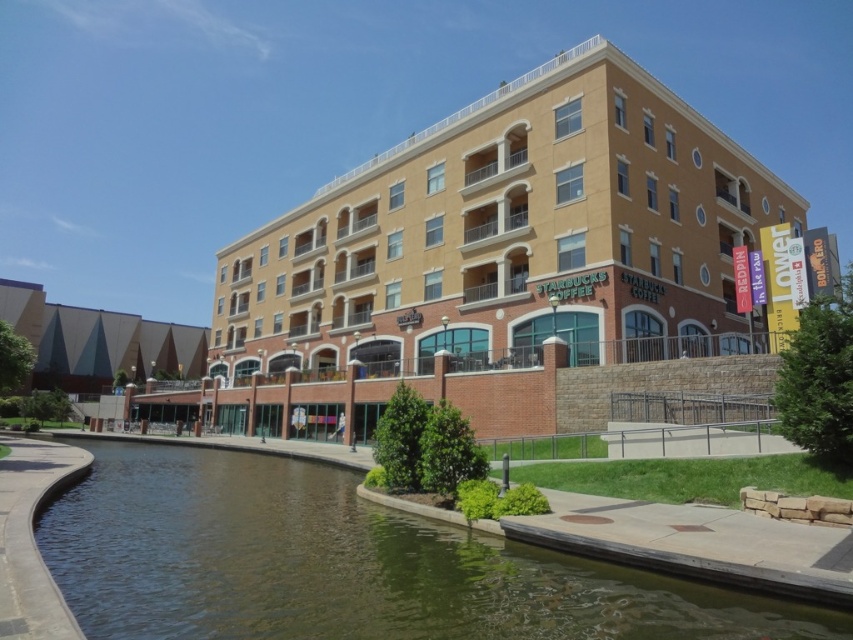
You are a city planner assessing the building and river in the scene. Which object, the beige brick building at center or the brown concrete river at lower left, has a greater vertical height?

The beige brick building at center is much taller than the brown concrete river at lower left, so it has a greater vertical height.

You are standing at the point labeled point (508, 237) in the image. Which object are you closest to?

The point labeled point (508, 237) is closest to the beige brick building at center.